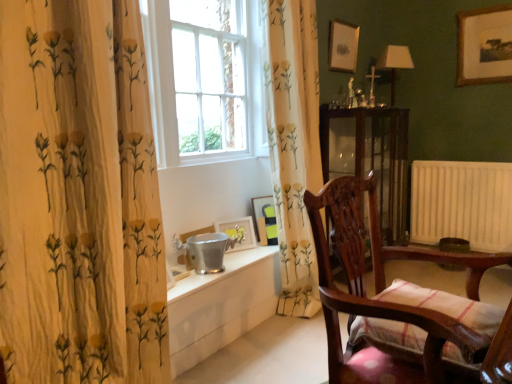
Find the location of a particular element. The height and width of the screenshot is (384, 512). free space in front of matte silver picture frame at lower center, the 2th picture frame positioned from the bottom is located at coordinates (238, 259).